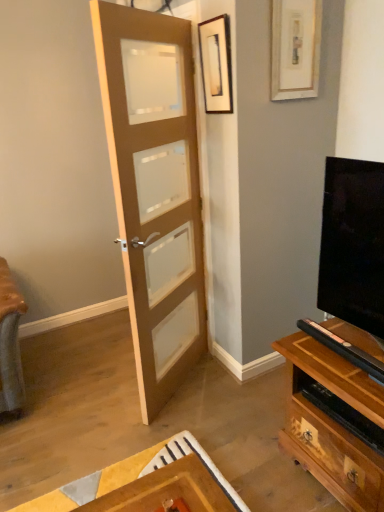
You are a GUI agent. You are given a task and a screenshot of the screen. Output one action in this format:
    pyautogui.click(x=<x>, y=<y>)
    Task: Click on the vacant space underneath matte wood door at center (from a real-world perspective)
    Image resolution: width=384 pixels, height=512 pixels.
    Given the screenshot: What is the action you would take?
    pyautogui.click(x=182, y=388)